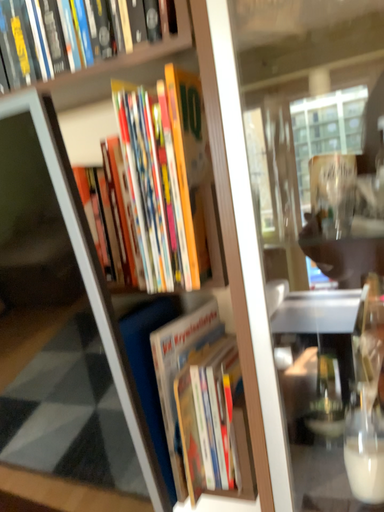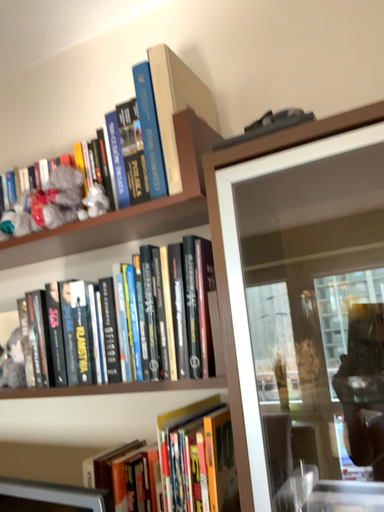
Question: Which way did the camera rotate in the video?

Choices:
 (A) rotated upward
 (B) rotated downward

Answer: (A)